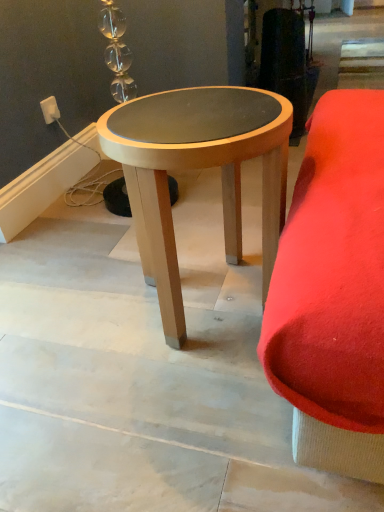
Image resolution: width=384 pixels, height=512 pixels. What are the coordinates of `free region on the left part of light wood/woodenobject at center` in the screenshot? It's located at (72, 315).